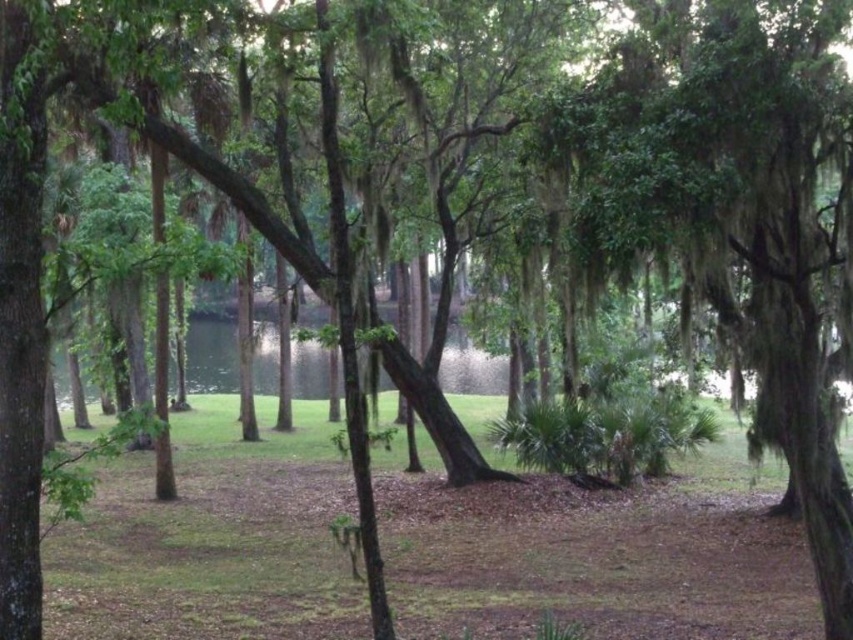
Question: Is green grass at center to the left of green mossy tree at center from the viewer's perspective?

Choices:
 (A) no
 (B) yes

Answer: (B)

Question: Which of the following is the farthest from the observer?

Choices:
 (A) green grass at center
 (B) green mossy tree at center

Answer: (A)

Question: Which of the following is the farthest from the observer?

Choices:
 (A) (728, 502)
 (B) (608, 60)

Answer: (A)

Question: Does green grass at center appear on the right side of green mossy tree at center?

Choices:
 (A) no
 (B) yes

Answer: (A)

Question: Does green grass at center appear on the left side of green mossy tree at center?

Choices:
 (A) yes
 (B) no

Answer: (A)